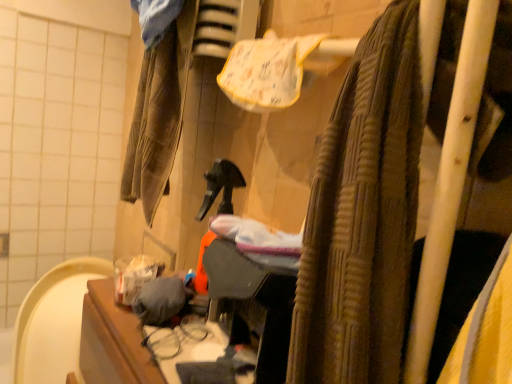
Question: Does gray fabric at center, the 2th clothing when ordered from top to bottom, lie behind brown corduroy pants at left, the 2th clothing when ordered from front to back?

Choices:
 (A) no
 (B) yes

Answer: (A)

Question: From the image's perspective, is gray fabric at center, arranged as the 2th clothing when viewed from the back, under brown corduroy pants at left, the first clothing in the top-to-bottom sequence?

Choices:
 (A) yes
 (B) no

Answer: (A)

Question: Is the surface of gray fabric at center, the 2th clothing when ordered from top to bottom, in direct contact with brown corduroy pants at left, the first clothing positioned from the back?

Choices:
 (A) no
 (B) yes

Answer: (A)

Question: Is gray fabric at center, which is counted as the 1th clothing, starting from the front, wider than brown corduroy pants at left, the first clothing in the top-to-bottom sequence?

Choices:
 (A) no
 (B) yes

Answer: (A)

Question: From the image's perspective, would you say gray fabric at center, which is counted as the first clothing, starting from the bottom, is positioned over brown corduroy pants at left, the first clothing in the top-to-bottom sequence?

Choices:
 (A) yes
 (B) no

Answer: (B)

Question: Does gray fabric at center, which is counted as the 1th clothing, starting from the front, have a greater height compared to brown corduroy pants at left, the 2th clothing when ordered from front to back?

Choices:
 (A) no
 (B) yes

Answer: (A)

Question: Is brown textured towel at upper right next to gray fabric at center, arranged as the 2th clothing when viewed from the back?

Choices:
 (A) no
 (B) yes

Answer: (A)

Question: Can we say brown textured towel at upper right lies outside gray fabric at center, arranged as the 2th clothing when viewed from the back?

Choices:
 (A) no
 (B) yes

Answer: (B)

Question: Can you confirm if brown textured towel at upper right is smaller than gray fabric at center, arranged as the 2th clothing when viewed from the back?

Choices:
 (A) no
 (B) yes

Answer: (A)

Question: Does brown textured towel at upper right have a larger size compared to gray fabric at center, which is counted as the 1th clothing, starting from the front?

Choices:
 (A) no
 (B) yes

Answer: (B)

Question: From the image's perspective, does brown textured towel at upper right appear lower than gray fabric at center, which is counted as the 1th clothing, starting from the front?

Choices:
 (A) no
 (B) yes

Answer: (A)

Question: Is brown textured towel at upper right positioned in front of gray fabric at center, which is counted as the 1th clothing, starting from the front?

Choices:
 (A) yes
 (B) no

Answer: (A)

Question: Is brown textured towel at upper right oriented away from brown corduroy pants at left, the first clothing in the top-to-bottom sequence?

Choices:
 (A) no
 (B) yes

Answer: (A)